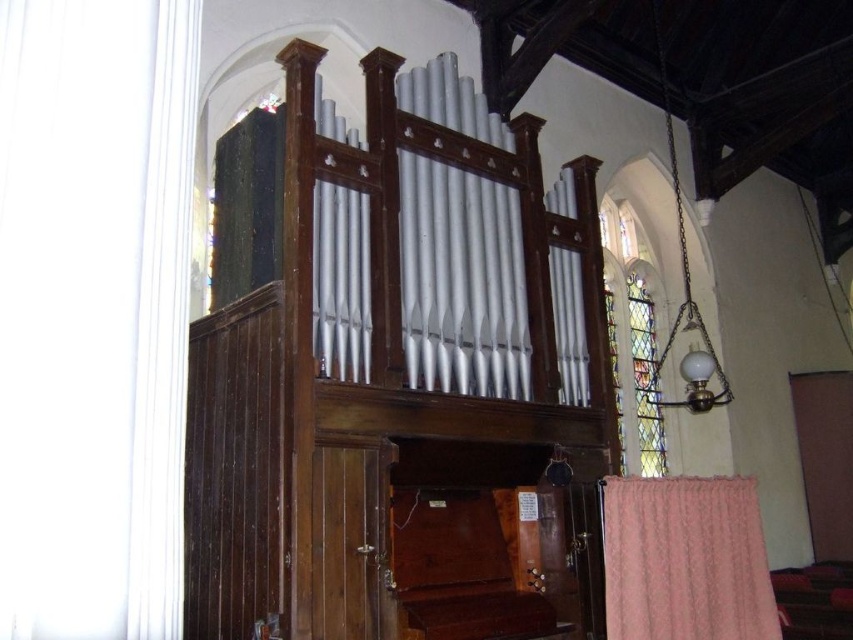
You are standing in the church facing the pipe organ. There is a pink knitted curtain at lower right. Where is the pink knitted curtain located relative to the pipe organ?

The pink knitted curtain at lower right is located at point (685, 560) relative to the pipe organ.

You are standing in the church and want to take a photo of the metallic silver pipes at center and the black velvet curtain at upper left. Which object will appear larger in your photo?

The metallic silver pipes at center will appear larger in your photo since they are closer to the viewer than the black velvet curtain at upper left.